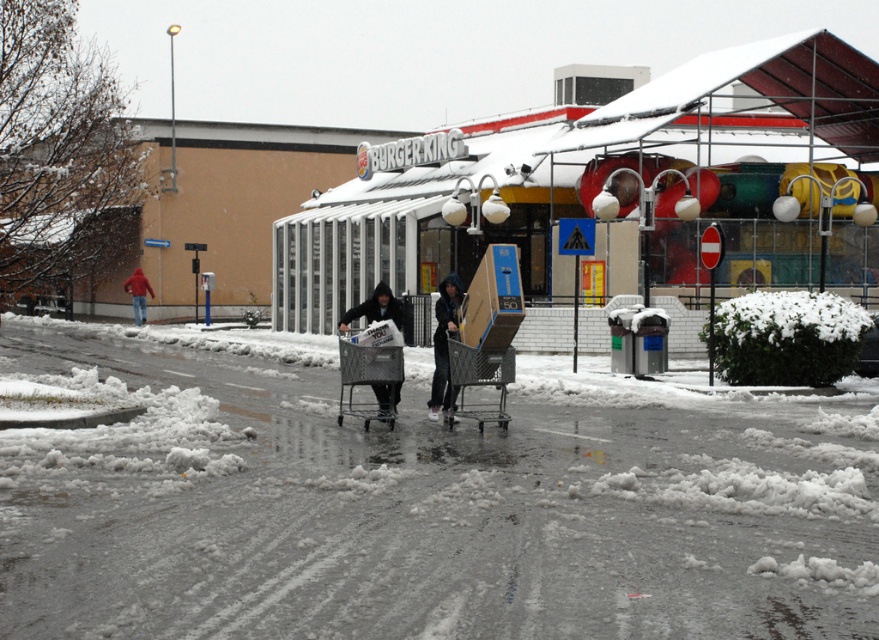
What is the exact coordinate of the snowy asphalt pavement at center?

The snowy asphalt pavement at center is located at point (416, 513).

You are standing at the entrance of the Burger King restaurant and want to take a photo that includes both point [455,362] and point [139,291]. Which point will appear larger in your photo?

Point [455,362] is closer to the camera than point [139,291], so it will appear larger in the photo.

You are a delivery person trying to reach the entrance of the Burger King restaurant. You see a dark gray hoodie at center and a dark gray fabric cart at center. Which object is closer to you?

The dark gray hoodie at center is closer to you because it is positioned over the dark gray fabric cart at center, indicating it is in front.